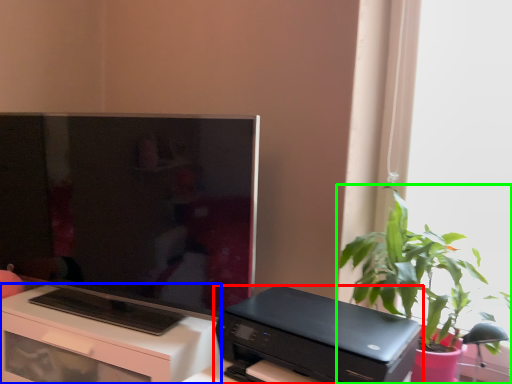
Question: Which is farther away from printer (highlighted by a red box)? desk (highlighted by a blue box) or houseplant (highlighted by a green box)?

Choices:
 (A) desk
 (B) houseplant

Answer: (A)